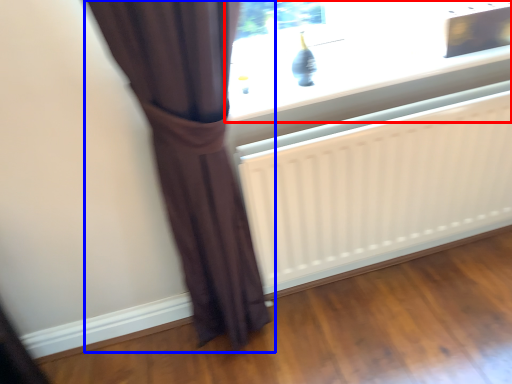
Question: Which point is further to the camera, window (highlighted by a red box) or curtain (highlighted by a blue box)?

Choices:
 (A) window
 (B) curtain

Answer: (A)